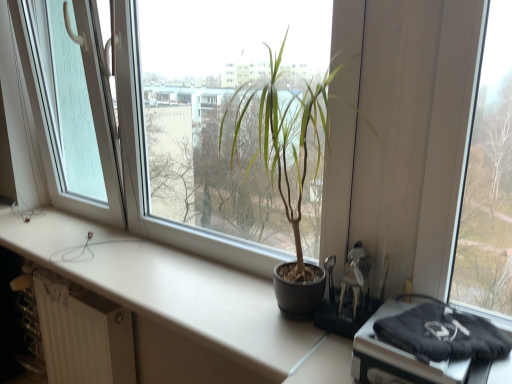
Identify the location of free spot above white matte counter top at center (from a real-world perspective). (164, 279).